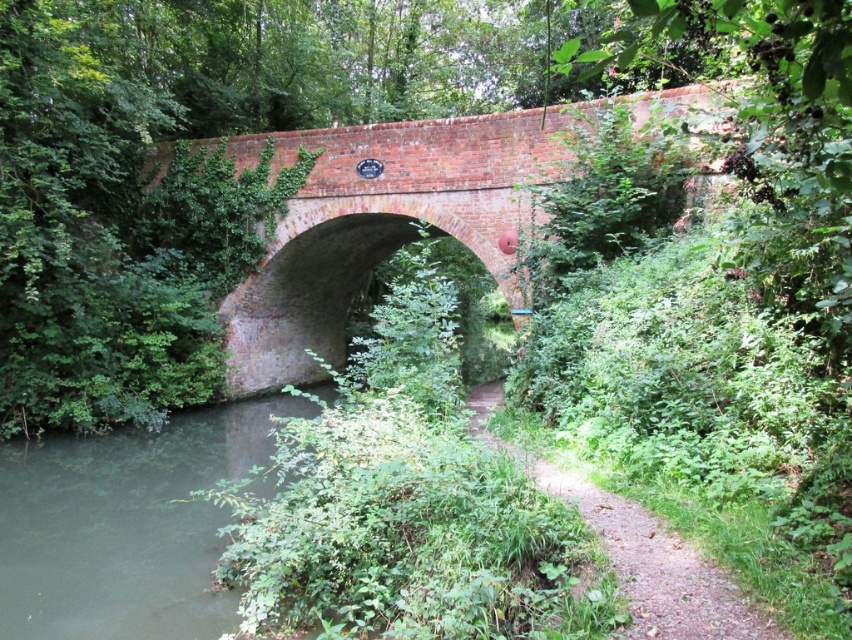
Question: Is brick at center bigger than dirt path at center?

Choices:
 (A) no
 (B) yes

Answer: (B)

Question: Is green murky water at lower left to the left of dirt path at center from the viewer's perspective?

Choices:
 (A) no
 (B) yes

Answer: (B)

Question: Which point is closer to the camera taking this photo?

Choices:
 (A) (531, 150)
 (B) (93, 636)

Answer: (B)

Question: Can you confirm if brick at center is positioned below green murky water at lower left?

Choices:
 (A) yes
 (B) no

Answer: (B)

Question: Which point appears closest to the camera in this image?

Choices:
 (A) (93, 637)
 (B) (452, 124)
 (C) (473, 412)

Answer: (A)

Question: Which point is closer to the camera taking this photo?

Choices:
 (A) (27, 611)
 (B) (475, 410)

Answer: (A)